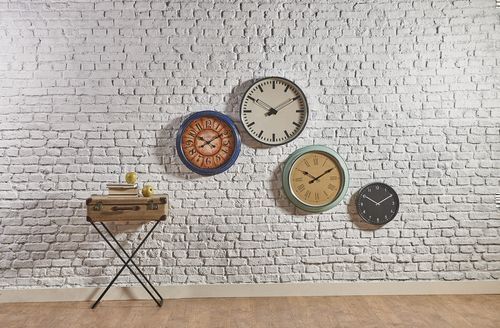
In order to click on clock hands in this screenshot , I will do click(284, 105), click(322, 170), click(382, 198), click(368, 198), click(307, 172), click(263, 100), click(212, 137), click(196, 137).